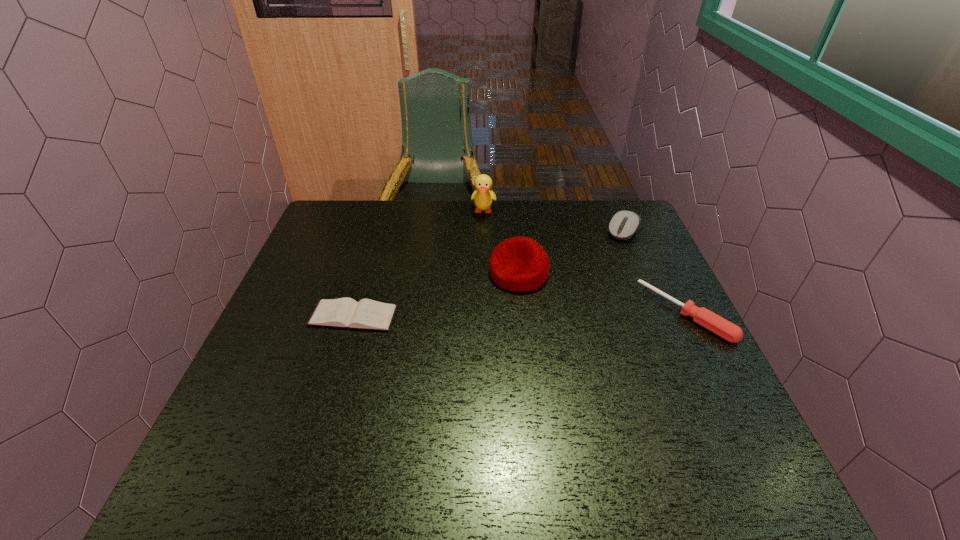
Where is `free space that satisfies the following two spatial constraints: 1. on the front side of the computer equipment; 2. on the right side of the duckling`? free space that satisfies the following two spatial constraints: 1. on the front side of the computer equipment; 2. on the right side of the duckling is located at coordinates (484, 231).

The height and width of the screenshot is (540, 960). I want to click on free space that satisfies the following two spatial constraints: 1. on the front side of the second shortest object; 2. on the left side of the third tallest object, so click(x=659, y=313).

This screenshot has height=540, width=960. Find the location of `vacant space that satisfies the following two spatial constraints: 1. on the front side of the tallest object; 2. on the left side of the beanbag`. vacant space that satisfies the following two spatial constraints: 1. on the front side of the tallest object; 2. on the left side of the beanbag is located at coordinates (485, 273).

Identify the location of vacant area in the image that satisfies the following two spatial constraints: 1. on the front side of the screwdriver; 2. on the left side of the beanbag. [x=523, y=313].